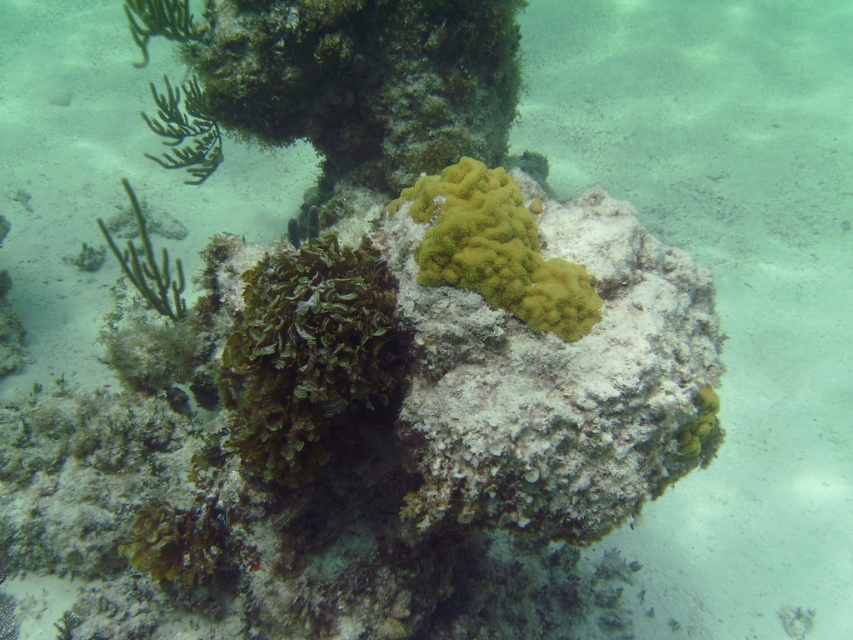
You are a marine biologist observing the underwater scene. You notice the green leafy algae at center and the yellow coral at center. Which of these two objects is taller?

The green leafy algae at center is much taller than the yellow coral at center.

You are a marine biologist observing the underwater scene. You notice the green leafy algae at center and the green matte algae at left. Which of these two algae is closer to your viewpoint?

The green leafy algae at center is closer to your viewpoint because it is positioned in front of the green matte algae at left.